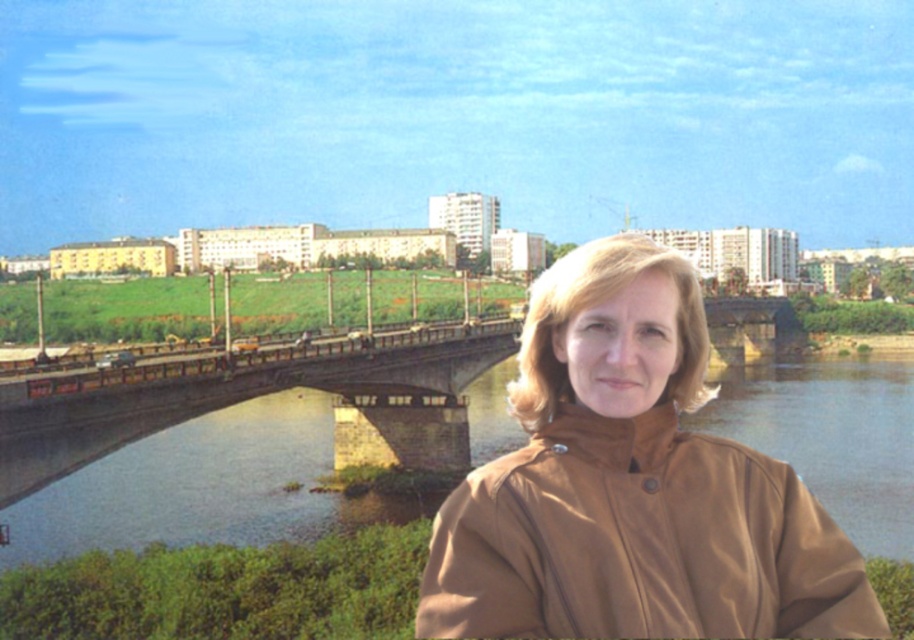
Question: Does brown matte trench coat at lower right come behind brown stone bridge at center?

Choices:
 (A) no
 (B) yes

Answer: (A)

Question: Where is brown matte trench coat at lower right located in relation to brown stone bridge at center in the image?

Choices:
 (A) left
 (B) right

Answer: (A)

Question: Which object appears farthest from the camera in this image?

Choices:
 (A) brown matte trench coat at lower right
 (B) brown stone bridge at center

Answer: (B)

Question: Does brown matte trench coat at lower right come in front of brown stone bridge at center?

Choices:
 (A) yes
 (B) no

Answer: (A)